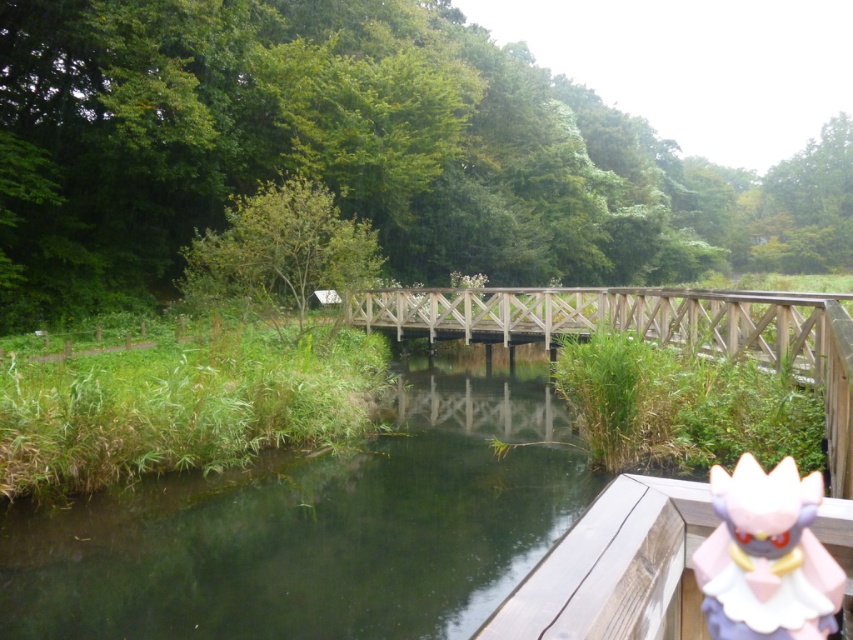
You are a delivery drone carrying a package that is 1 meter wide. You need to fly over the wooden bridge at center and avoid the pink plastic doll at lower right. Can your package fit between the bridge and the doll without hitting either?

The wooden bridge at center is wider than the pink plastic doll at lower right. However, the exact distance between them isn not specified. Without knowing the gap between the bridge and the doll, it is impossible to determine if the 1 meter wide package can safely pass through.